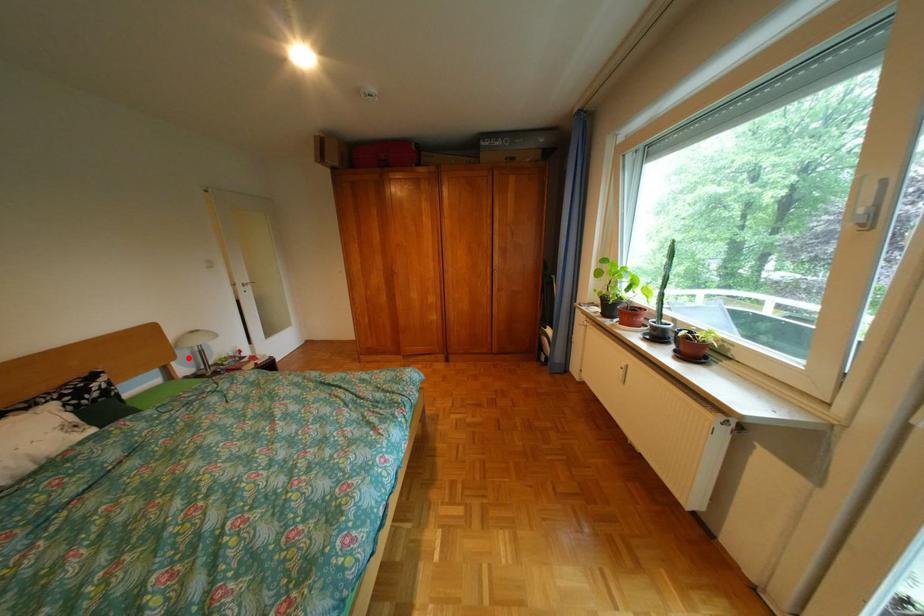
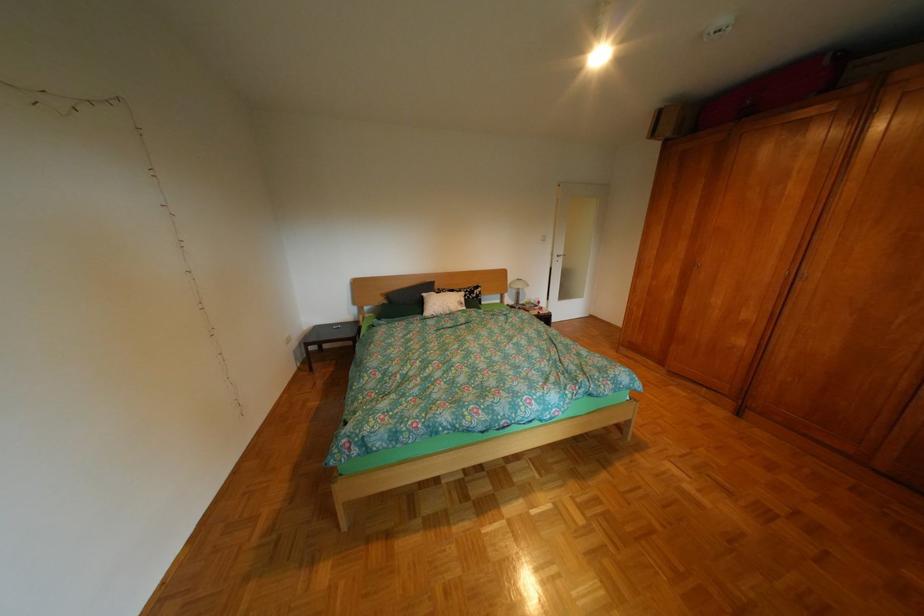
Find the pixel in the second image that matches the highlighted location in the first image.

(521, 292)